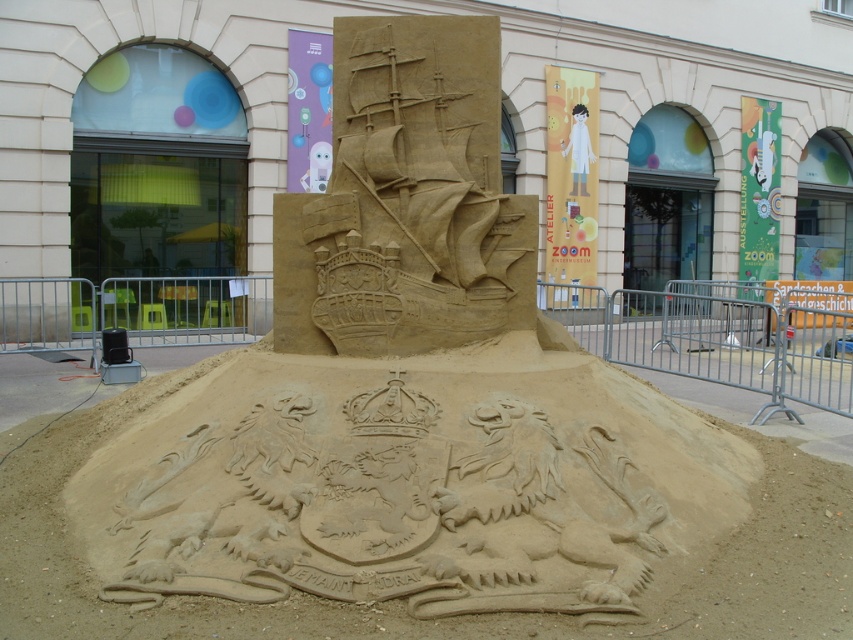
You are a sand sculpture artist who wants to add a new layer of sand on top of the natural sand at center. However, you need to ensure that the new layer won not exceed the height of the sandy ship at center. Can you do this?

The natural sand at center is not as tall as the sandy ship at center, so you can add a new layer of sand on top of the natural sand at center without exceeding the height of the sandy ship at center.

You are standing in front of a sand sculpture with a ship at the top and a heraldic emblem in the foreground. You want to touch the natural sand at center. Where should you reach to find it?

The natural sand at center is located at point coordinates of (415, 508).